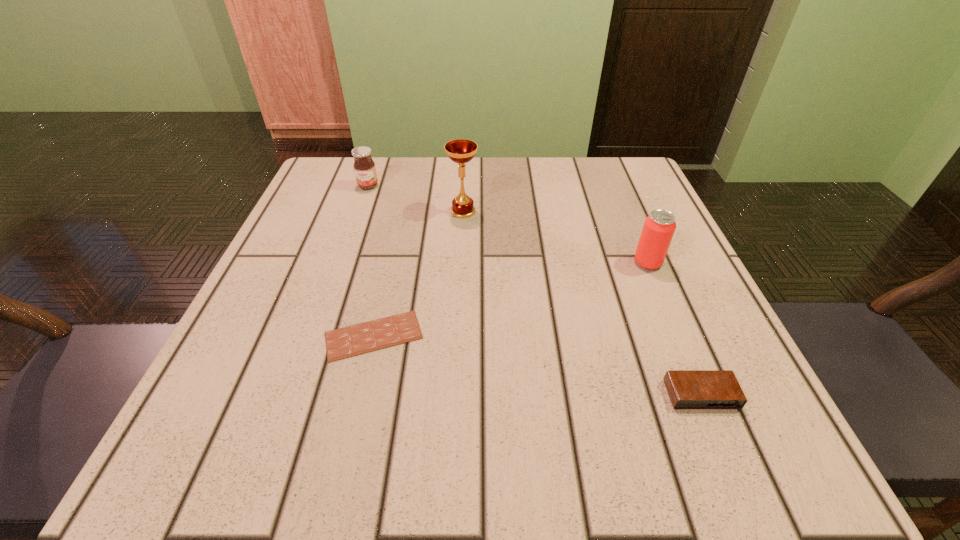
I want to click on the tallest object, so click(x=461, y=151).

At what (x,y) coordinates should I click in order to perform the action: click on chalice. Please return your answer as a coordinate pair (x, y). Image resolution: width=960 pixels, height=540 pixels. Looking at the image, I should click on (461, 151).

Locate an element on the screen. beer can is located at coordinates (659, 227).

Locate an element on the screen. the third nearest object is located at coordinates (659, 227).

Locate an element on the screen. the farthest object is located at coordinates (364, 167).

Identify the location of jam. This screenshot has height=540, width=960. (364, 167).

Image resolution: width=960 pixels, height=540 pixels. In order to click on the fourth tallest object in this screenshot , I will do `click(688, 389)`.

Locate an element on the screen. This screenshot has height=540, width=960. the nearest object is located at coordinates (688, 389).

You are a GUI agent. You are given a task and a screenshot of the screen. Output one action in this format:
    pyautogui.click(x=<x>, y=<y>)
    Task: Click on the chocolate bar
    
    Given the screenshot: What is the action you would take?
    pyautogui.click(x=366, y=337)

Identify the location of the second nearest object. The image size is (960, 540). (366, 337).